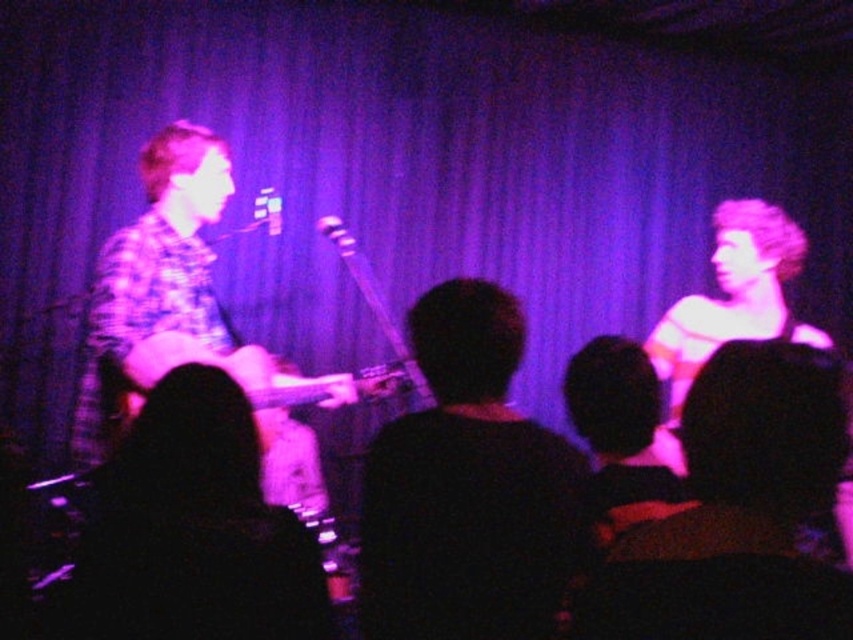
Question: Does dark brown leather jacket at center appear under wooden acoustic guitar at center?

Choices:
 (A) yes
 (B) no

Answer: (A)

Question: Which object is closer to the camera taking this photo?

Choices:
 (A) dark brown leather jacket at center
 (B) wooden acoustic guitar at center

Answer: (A)

Question: Does dark brown leather jacket at center appear on the right side of wooden acoustic guitar at center?

Choices:
 (A) yes
 (B) no

Answer: (A)

Question: From the image, what is the correct spatial relationship of dark brown leather jacket at center in relation to wooden acoustic guitar at center?

Choices:
 (A) left
 (B) right

Answer: (B)

Question: Which of the following is the farthest from the observer?

Choices:
 (A) (315, 396)
 (B) (364, 561)

Answer: (A)